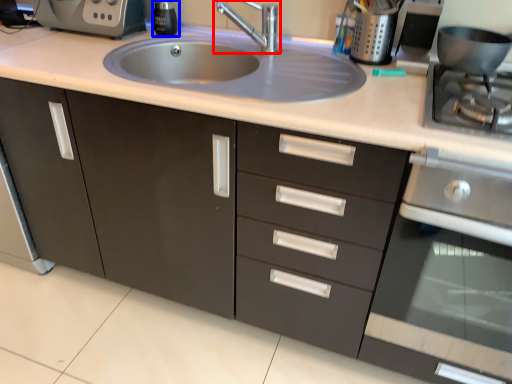
Question: Which point is further to the camera, tap (highlighted by a red box) or soap dispenser (highlighted by a blue box)?

Choices:
 (A) tap
 (B) soap dispenser

Answer: (B)